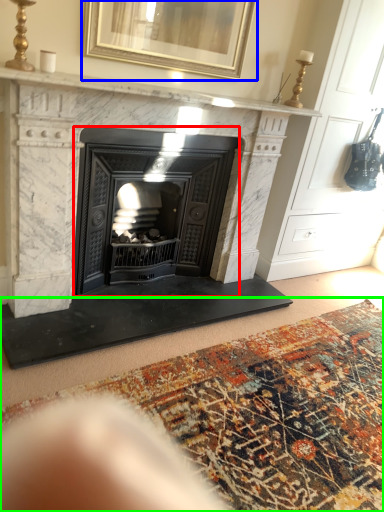
Question: Based on their relative distances, which object is nearer to wood burning stove (highlighted by a red box)? Choose from picture frame (highlighted by a blue box) and mat (highlighted by a green box).

Choices:
 (A) picture frame
 (B) mat

Answer: (A)